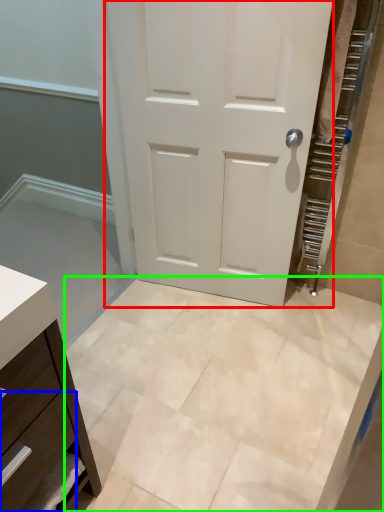
Question: Estimate the real-world distances between objects in this image. Which object is closer to door (highlighted by a red box), drawer (highlighted by a blue box) or ceramic tile (highlighted by a green box)?

Choices:
 (A) drawer
 (B) ceramic tile

Answer: (B)